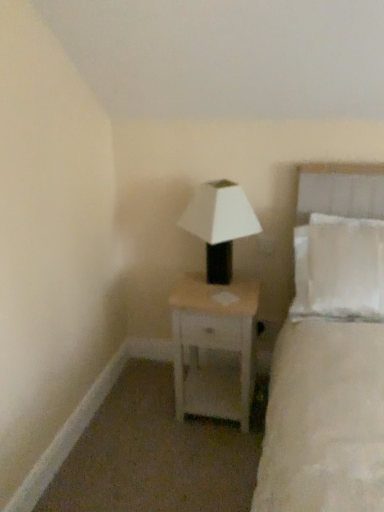
What do you see at coordinates (220, 225) in the screenshot?
I see `white matte lamp at center` at bounding box center [220, 225].

I want to click on white matte nightstand at center, so click(214, 346).

Locate an element on the screen. white matte lamp at center is located at coordinates (220, 225).

Is white fabric bed at right next to white matte nightstand at center?

There is a gap between white fabric bed at right and white matte nightstand at center.

From a real-world perspective, is white fabric bed at right positioned under white matte nightstand at center based on gravity?

Incorrect, from a real-world perspective, white fabric bed at right is higher than white matte nightstand at center.

Can you confirm if white fabric bed at right is smaller than white matte nightstand at center?

Actually, white fabric bed at right might be larger than white matte nightstand at center.

Does white fabric bed at right have a greater height compared to white matte nightstand at center?

Correct, white fabric bed at right is much taller as white matte nightstand at center.

Do you think white matte nightstand at center is within white fabric bed at right, or outside of it?

The correct answer is: outside.

Looking at this image, considering the sizes of objects white matte nightstand at center and white fabric bed at right in the image provided, who is smaller, white matte nightstand at center or white fabric bed at right?

white matte nightstand at center is smaller.

Can you confirm if white matte nightstand at center is positioned to the left of white fabric bed at right?

Yes, white matte nightstand at center is to the left of white fabric bed at right.

Is white matte nightstand at center next to white fabric bed at right?

No.

Which is behind, white matte lamp at center or white matte nightstand at center?

white matte nightstand at center.

Is white matte lamp at center wider than white matte nightstand at center?

Incorrect, the width of white matte lamp at center does not surpass that of white matte nightstand at center.

From the image's perspective, is white matte lamp at center above white matte nightstand at center?

Yes, from the image's perspective, white matte lamp at center is over white matte nightstand at center.

Which is nearer, (362,461) or (232,182)?

Point (362,461)

Is white fabric bed at right positioned far away from white matte lamp at center?

They are positioned close to each other.

Is white fabric bed at right located outside white matte lamp at center?

white fabric bed at right lies outside white matte lamp at center's area.

In the scene shown: Between white fabric bed at right and white matte lamp at center, which one has more height?

With more height is white fabric bed at right.

Is white matte nightstand at center not near white matte lamp at center?

No, white matte nightstand at center is not far away from white matte lamp at center.

Could you tell me if white matte nightstand at center is turned towards white matte lamp at center?

No, white matte nightstand at center is not turned towards white matte lamp at center.

Considering the relative sizes of white matte nightstand at center and white matte lamp at center in the image provided, is white matte nightstand at center shorter than white matte lamp at center?

Incorrect, the height of white matte nightstand at center does not fall short of that of white matte lamp at center.

Considering their positions, is white matte nightstand at center located in front of or behind white matte lamp at center?

Visually, white matte nightstand at center is located behind white matte lamp at center.

Is the depth of white matte lamp at center less than that of white fabric bed at right?

No, white matte lamp at center is behind white fabric bed at right.

From a real-world perspective, is white matte lamp at center physically above white fabric bed at right?

Indeed, from a real-world perspective, white matte lamp at center stands above white fabric bed at right.

Consider the image. Considering the sizes of objects white matte lamp at center and white fabric bed at right in the image provided, who is thinner, white matte lamp at center or white fabric bed at right?

Thinner between the two is white matte lamp at center.

Image resolution: width=384 pixels, height=512 pixels. Identify the location of bed that is above the white matte nightstand at center (from the image's perspective). (330, 361).

You are a GUI agent. You are given a task and a screenshot of the screen. Output one action in this format:
    pyautogui.click(x=<x>, y=<y>)
    Task: Click on the bed in front of the white matte nightstand at center
    Image resolution: width=384 pixels, height=512 pixels.
    Given the screenshot: What is the action you would take?
    pyautogui.click(x=330, y=361)

Which object lies nearer to the anchor point white fabric bed at right, white matte lamp at center or white matte nightstand at center?

Among the two, white matte nightstand at center is located nearer to white fabric bed at right.

Which object lies further to the anchor point white matte nightstand at center, white matte lamp at center or white fabric bed at right?

Among the two, white fabric bed at right is located further to white matte nightstand at center.

When comparing their distances from white matte nightstand at center, does white fabric bed at right or white matte lamp at center seem further?

white fabric bed at right is further to white matte nightstand at center.

Looking at the image, which one is located further to white matte lamp at center, white matte nightstand at center or white fabric bed at right?

The object further to white matte lamp at center is white fabric bed at right.

When comparing their distances from white matte lamp at center, does white fabric bed at right or white matte nightstand at center seem further?

Among the two, white fabric bed at right is located further to white matte lamp at center.

Based on their spatial positions, is white matte nightstand at center or white matte lamp at center closer to white fabric bed at right?

Based on the image, white matte nightstand at center appears to be nearer to white fabric bed at right.

You are a GUI agent. You are given a task and a screenshot of the screen. Output one action in this format:
    pyautogui.click(x=<x>, y=<y>)
    Task: Click on the bed that lies between white matte lamp at center and white matte nightstand at center from top to bottom
    This screenshot has height=512, width=384.
    Given the screenshot: What is the action you would take?
    pyautogui.click(x=330, y=361)